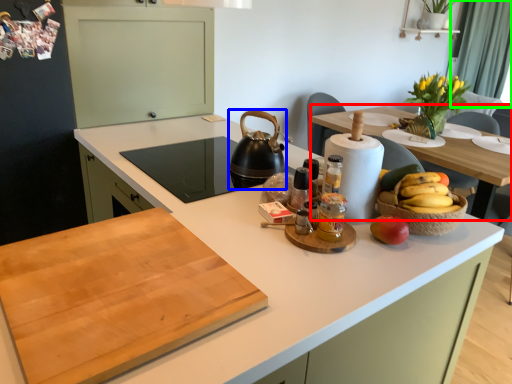
Question: Based on their relative distances, which object is nearer to table (highlighted by a red box)? Choose from kitchen appliance (highlighted by a blue box) and curtain (highlighted by a green box).

Choices:
 (A) kitchen appliance
 (B) curtain

Answer: (A)